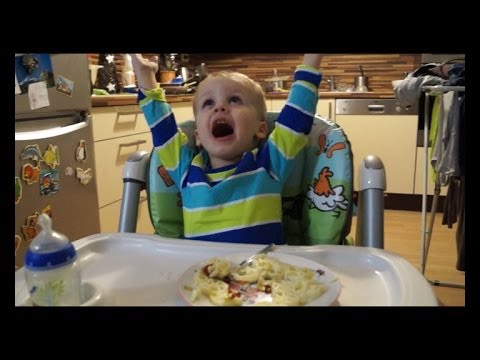
Where is `dishwasher`? Image resolution: width=480 pixels, height=360 pixels. dishwasher is located at coordinates (370, 132).